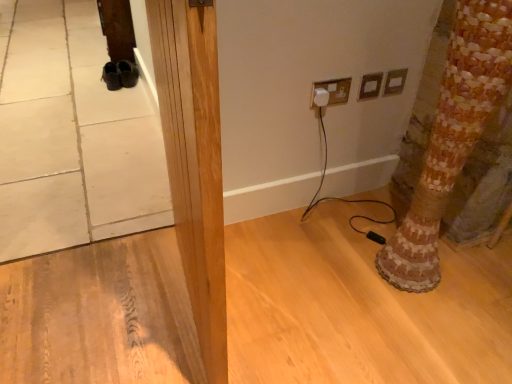
I want to click on blank space to the left of wooden mosaic tree trunk at lower right, so click(x=347, y=272).